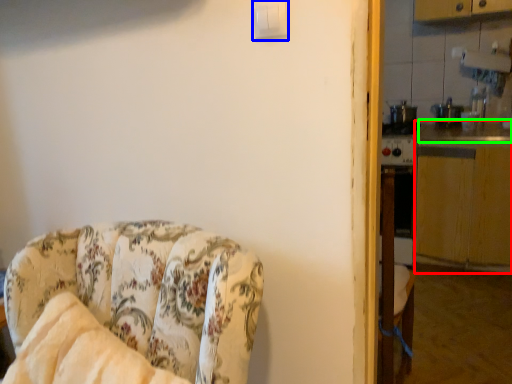
Question: Estimate the real-world distances between objects in this image. Which object is closer to counter top (highlighted by a red box), light switch (highlighted by a blue box) or counter top (highlighted by a green box)?

Choices:
 (A) light switch
 (B) counter top

Answer: (B)